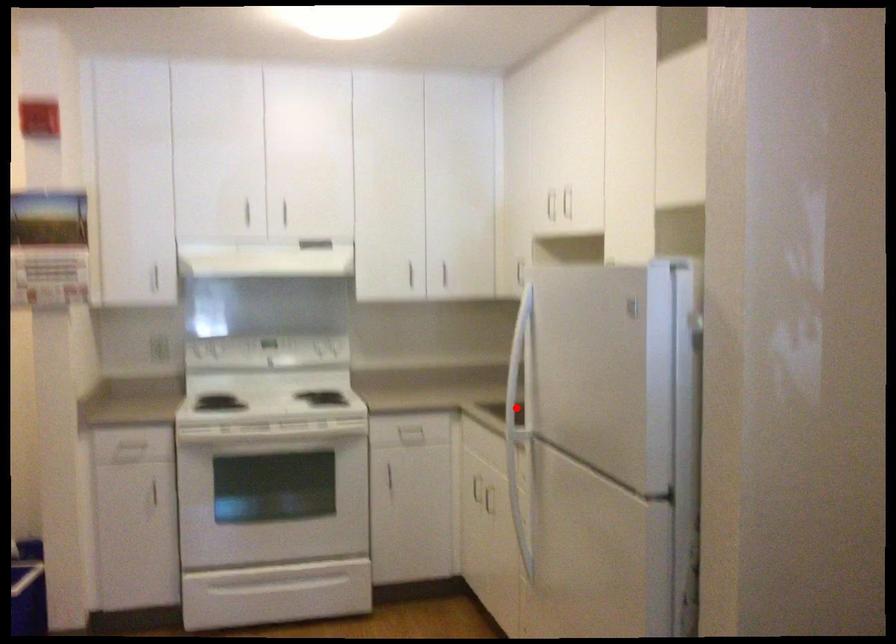
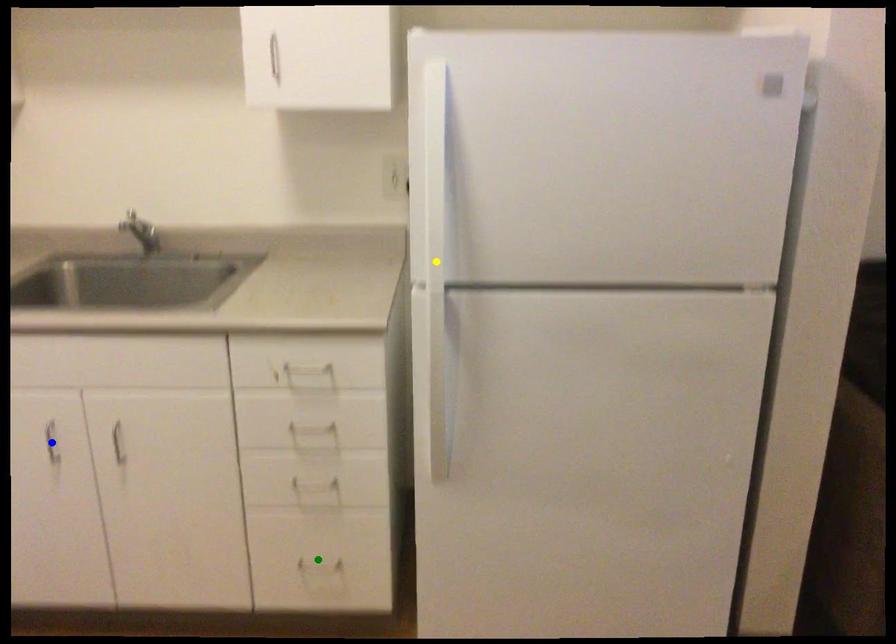
Question: I am providing you with two images of the same scene from different viewpoints. A red point is marked on the first image. You are given multiple points on the second image. Can you choose the point in image 2 that corresponds to the point in image 1?

Choices:
 (A) yellow point
 (B) blue point
 (C) green point

Answer: (A)